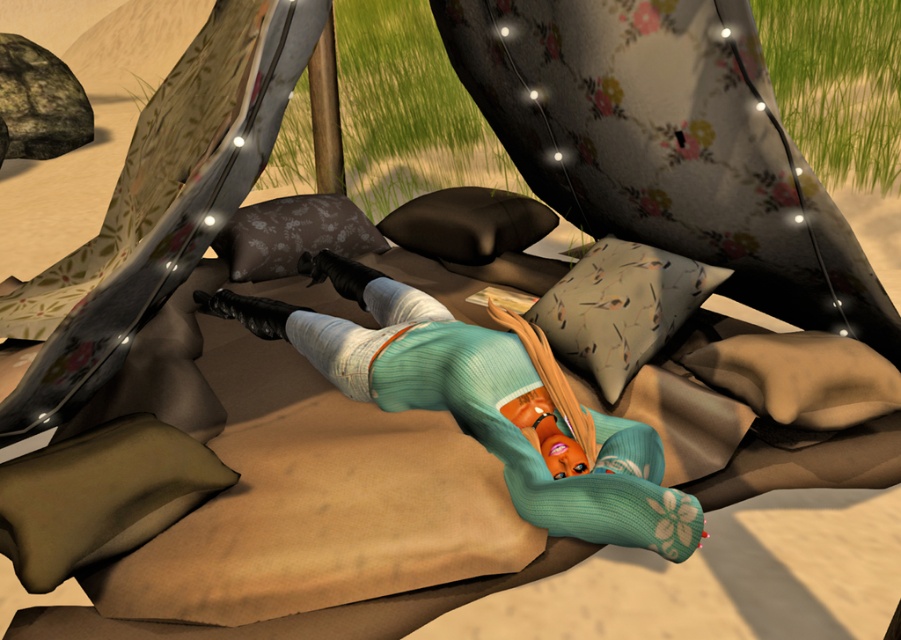
Question: Which of the following is the closest to the observer?

Choices:
 (A) (463, 237)
 (B) (269, 273)
 (C) (566, 339)

Answer: (C)

Question: Where is floral fabric pillow at upper center located in relation to black matte pillow at center in the image?

Choices:
 (A) left
 (B) right

Answer: (A)

Question: Can you confirm if gray fabric pillow with bird pattern at center is wider than black matte pillow at center?

Choices:
 (A) no
 (B) yes

Answer: (A)

Question: Can you confirm if dark olive green fabric pillow at lower left is positioned to the left of floral fabric pillow at upper center?

Choices:
 (A) yes
 (B) no

Answer: (A)

Question: Which of the following is the closest to the observer?

Choices:
 (A) (639, 333)
 (B) (402, 236)

Answer: (A)

Question: Which point is closer to the camera taking this photo?

Choices:
 (A) (289, 272)
 (B) (601, 381)
 (C) (87, 547)

Answer: (C)